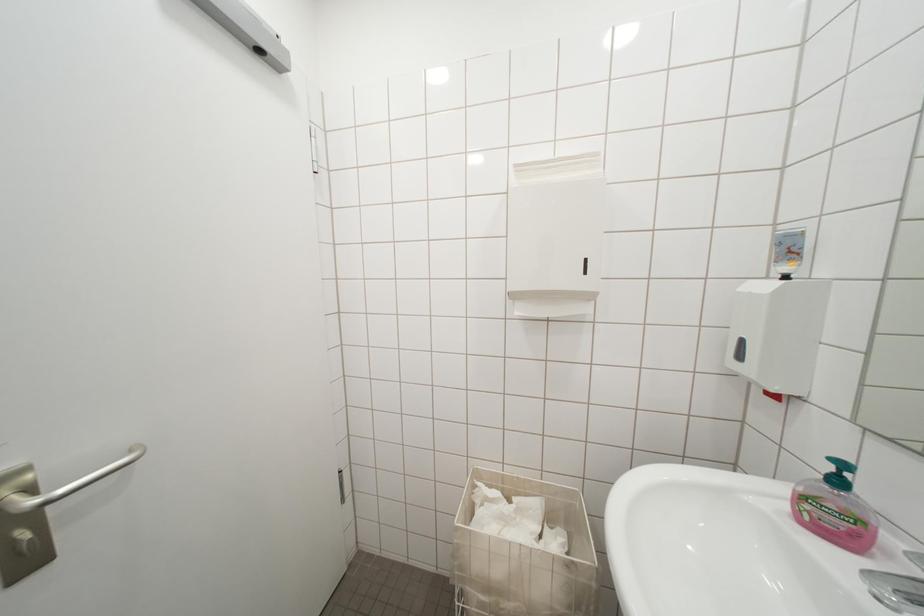
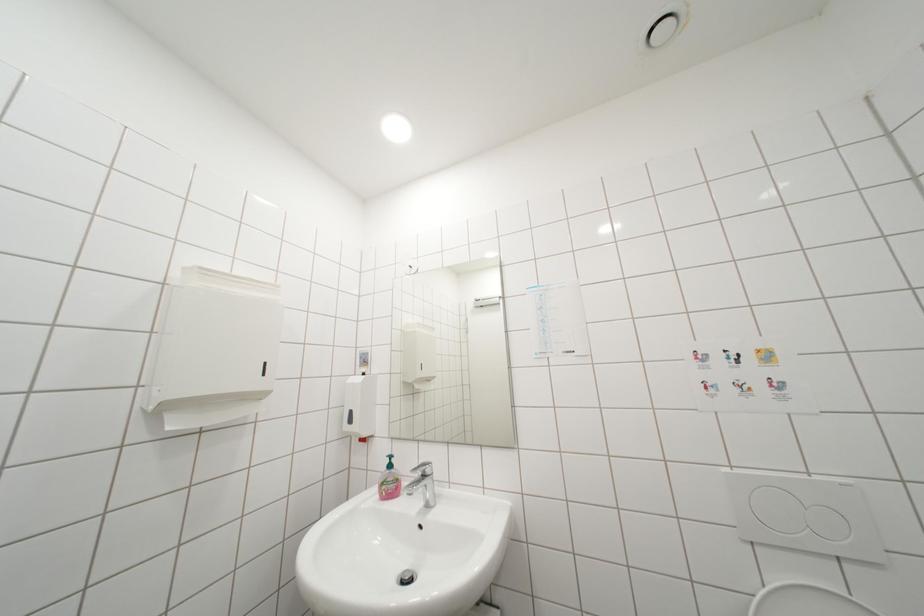
How did the camera likely rotate?

The camera's rotation is toward right-up.